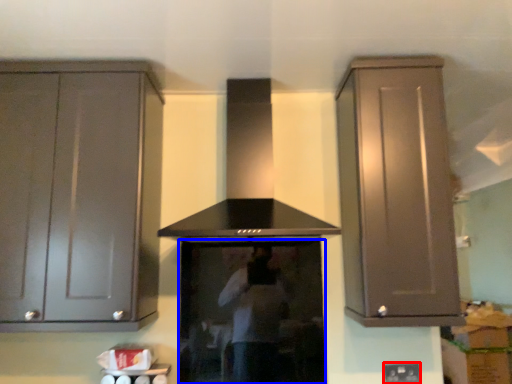
Question: Among these objects, which one is farthest to the camera, electric outlet (highlighted by a red box) or appliance (highlighted by a blue box)?

Choices:
 (A) electric outlet
 (B) appliance

Answer: (A)